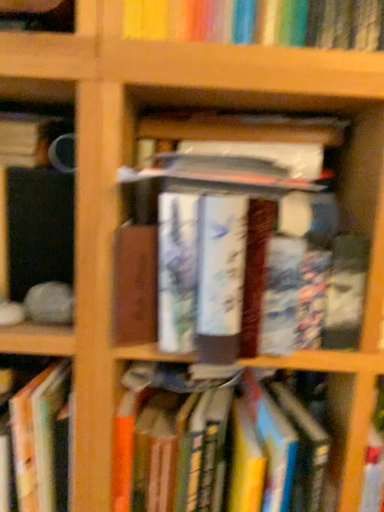
Question: Is point (29, 443) closer or farther from the camera than point (178, 386)?

Choices:
 (A) closer
 (B) farther

Answer: (A)

Question: Is hardcover book at lower left, the second book from the bottom, to the left or to the right of hardcover book at center, which is the first book in bottom-to-top order, in the image?

Choices:
 (A) right
 (B) left

Answer: (B)

Question: Estimate the real-world distances between objects in this image. Which object is farther from the hardcover book at center, arranged as the 3th book when ordered from the bottom?

Choices:
 (A) hardcover book at center, which is the first book in bottom-to-top order
 (B) hardcover book at lower left, the third book when ordered from top to bottom
 (C) matte black mug at left, which is the fourth book in bottom-to-top order
 (D) wooden shelf at upper center

Answer: (C)

Question: Based on their relative distances, which object is farther from the matte black mug at left, arranged as the 1th book when viewed from the top?

Choices:
 (A) hardcover book at center, the 2th book from the top
 (B) wooden shelf at upper center
 (C) hardcover book at center, which is counted as the fourth book, starting from the top
 (D) hardcover book at lower left, the third book when ordered from top to bottom

Answer: (C)